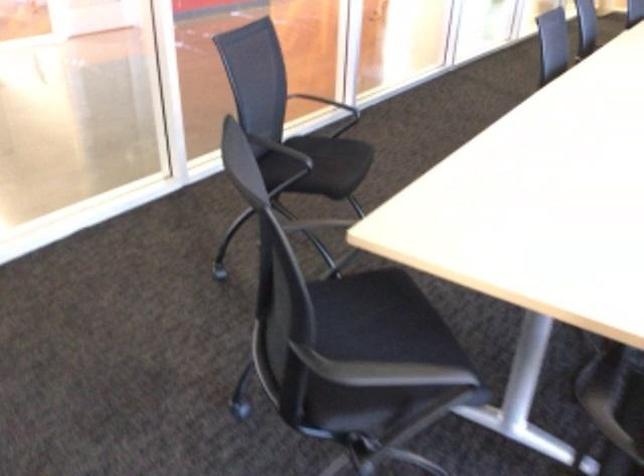
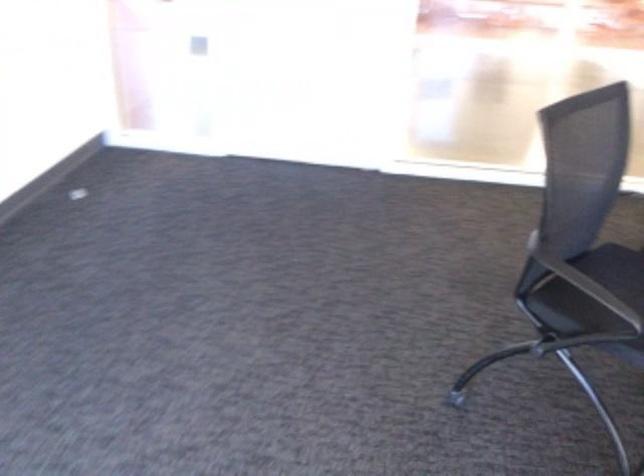
Where in the second image is the point corresponding to the point at 319,314 from the first image?

(616, 269)